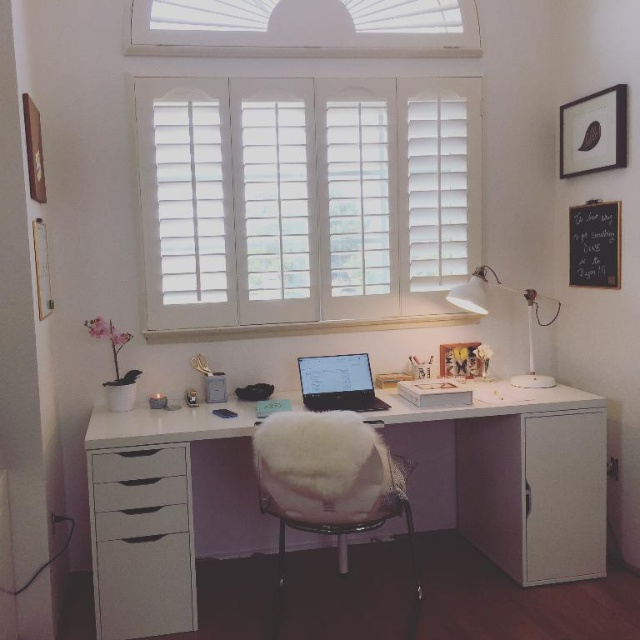
You are standing in the home office and want to place a new plant on the desk. The desk is at point (524,476). Where should you go to place the plant?

The white glossy computer desk at center is located at point (524,476), so you should go to that coordinate to place the plant on the desk.

You are sitting at the desk and want to reach the white fluffy cushion at center. Can you grab it without moving around the white matte file cabinet at right?

The white fluffy cushion at center is behind the white matte file cabinet at right, so you cannot reach it without moving around the white matte file cabinet at right.